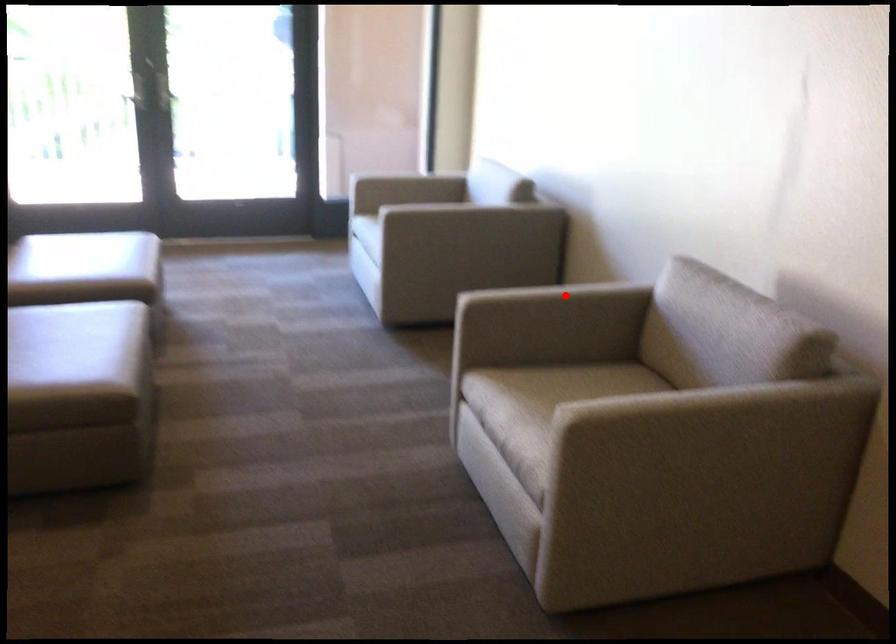
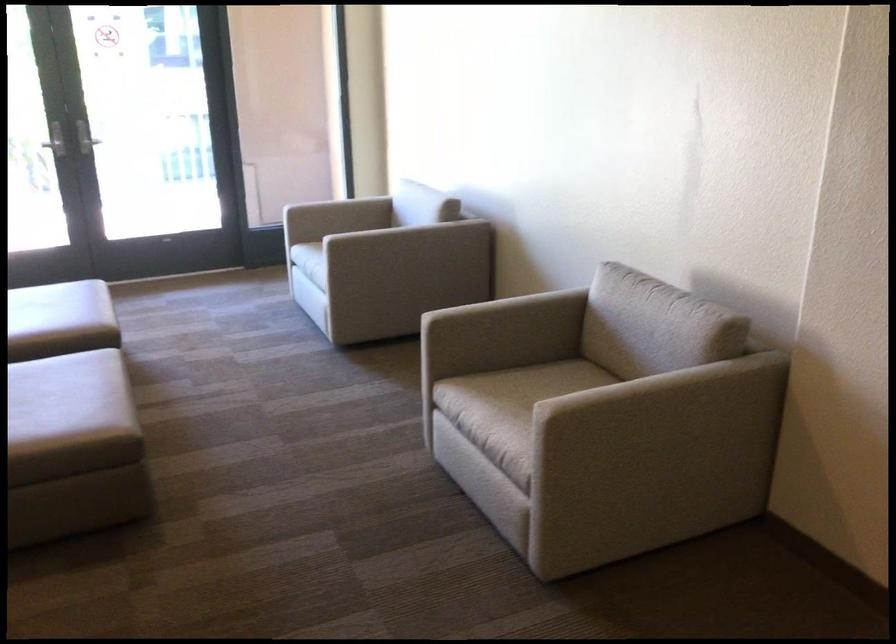
Where in the second image is the point corresponding to the highlighted location from the first image?

(513, 304)